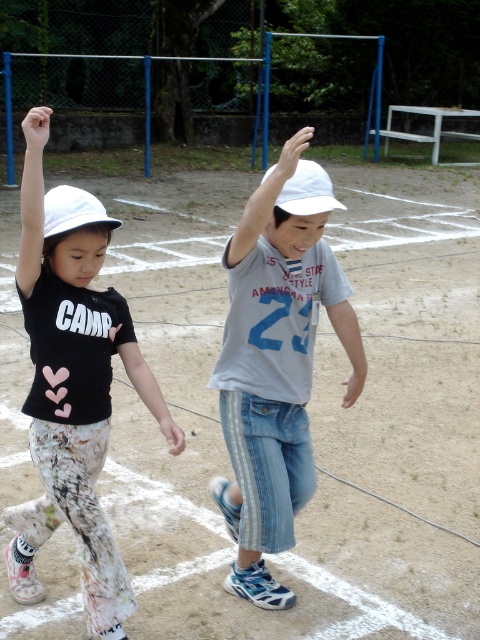
You are a photographer taking a picture of the two children. You notice the white matte baseball hat at upper center and the pink matte hand at center. Which object is positioned closer to you?

The white matte baseball hat at upper center is closer to the viewer than the pink matte hand at center.

You are a photographer trying to capture both the white matte baseball hat at upper center and the pink matte hand at center in a single frame. Based on their positions and sizes, which object should you focus on first to ensure both are in the frame?

The white matte baseball hat at upper center might be wider than the pink matte hand at center, so focusing on the hat first ensures that the wider object is centered, allowing the hand to fit into the frame as well.